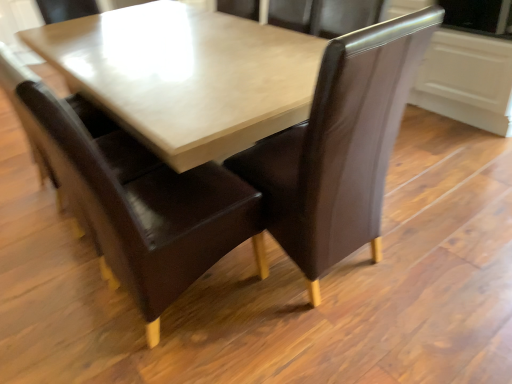
Find the location of a particular element. vacant space to the left of brown leather chair at center, the first chair in the left-to-right sequence is located at coordinates (52, 319).